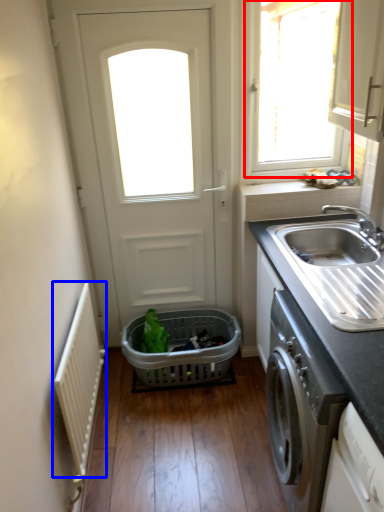
Question: Which of the following is the farthest to the observer, window (highlighted by a red box) or radiator (highlighted by a blue box)?

Choices:
 (A) window
 (B) radiator

Answer: (A)